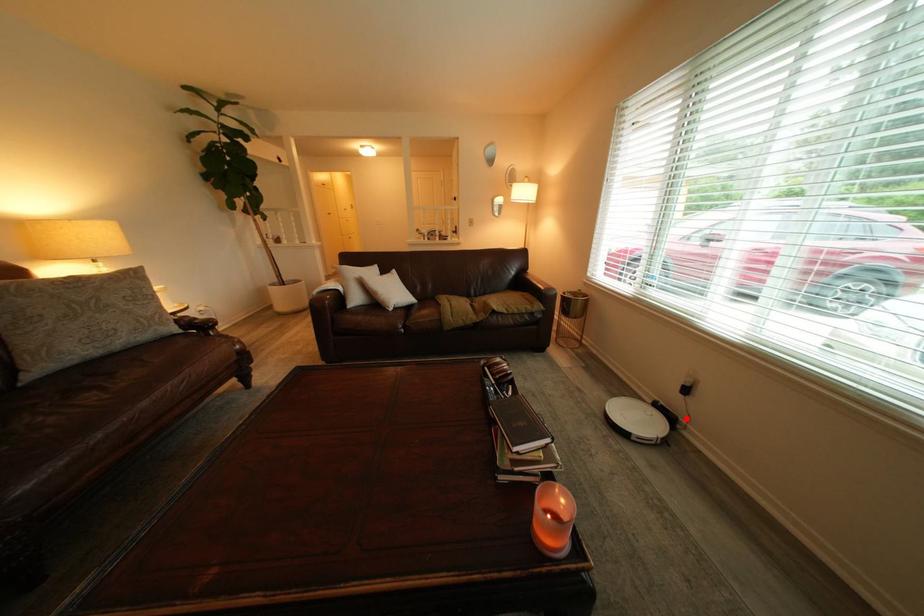
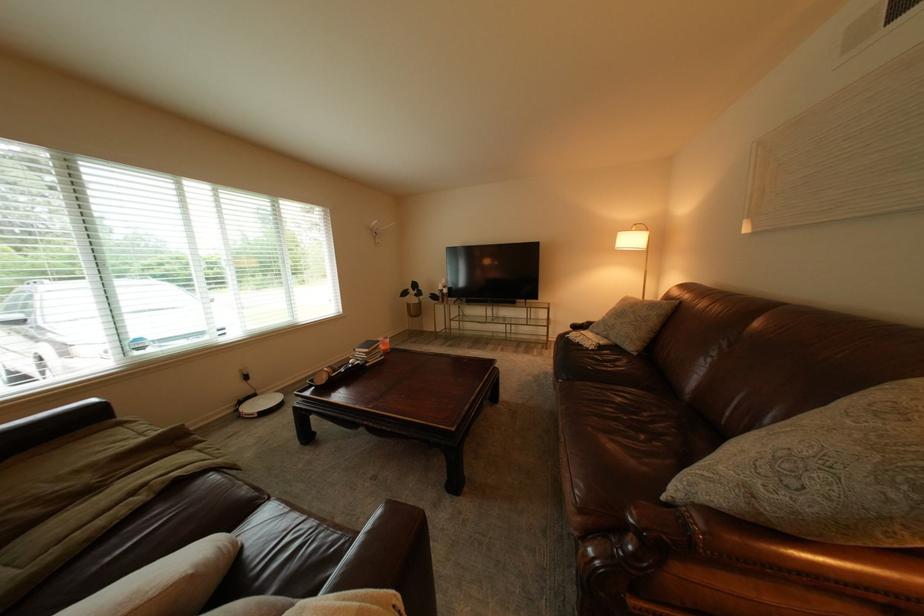
Question: I am providing you with two images of the same scene from different viewpoints. A red point is shown in image1. For the corresponding object point in image2, is it positioned nearer or farther from the camera?

Choices:
 (A) Nearer
 (B) Farther

Answer: (B)